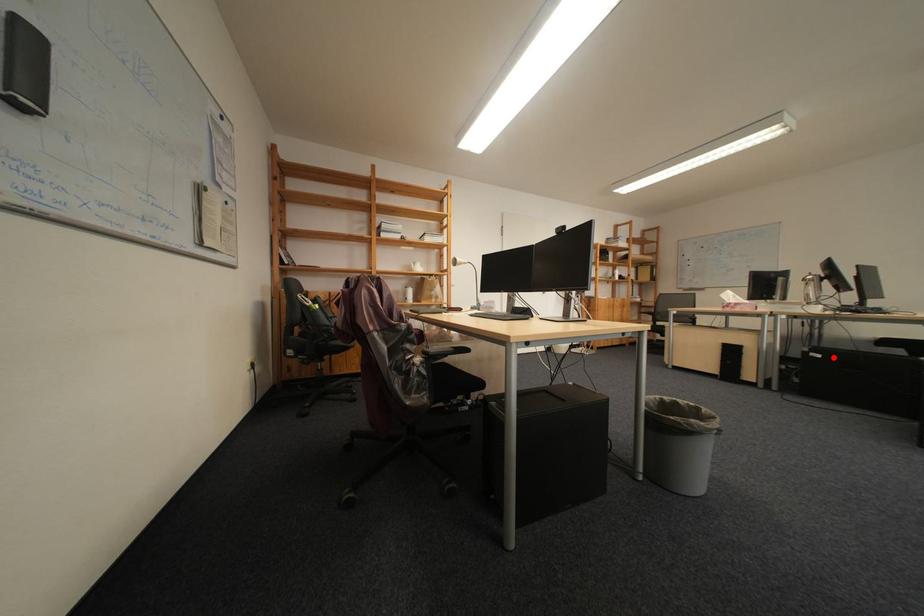
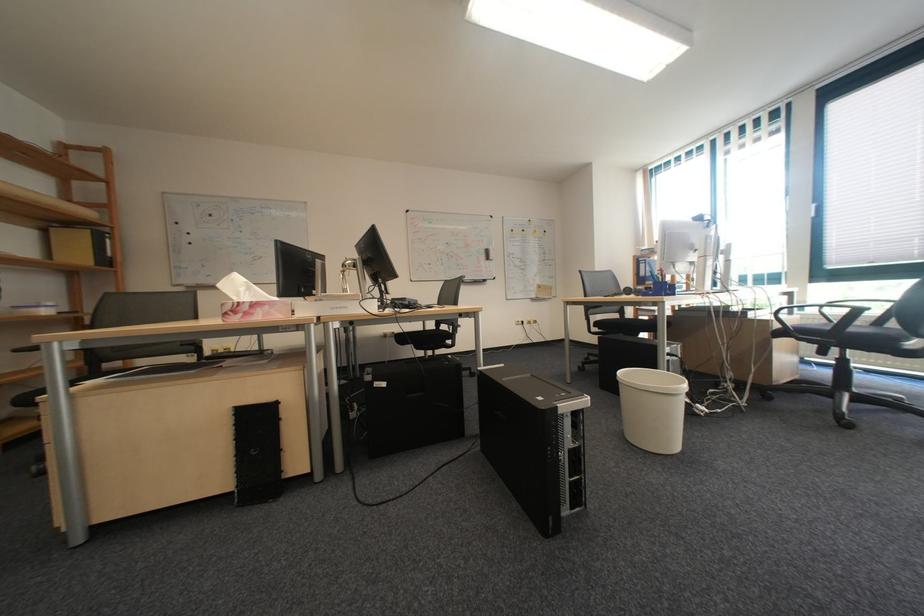
Question: A red point is marked in image1. In image2, is the corresponding 3D point closer to the camera or farther? Reply with the corresponding letter.

Choices:
 (A) The corresponding 3D point is closer.
 (B) The corresponding 3D point is farther.

Answer: (B)